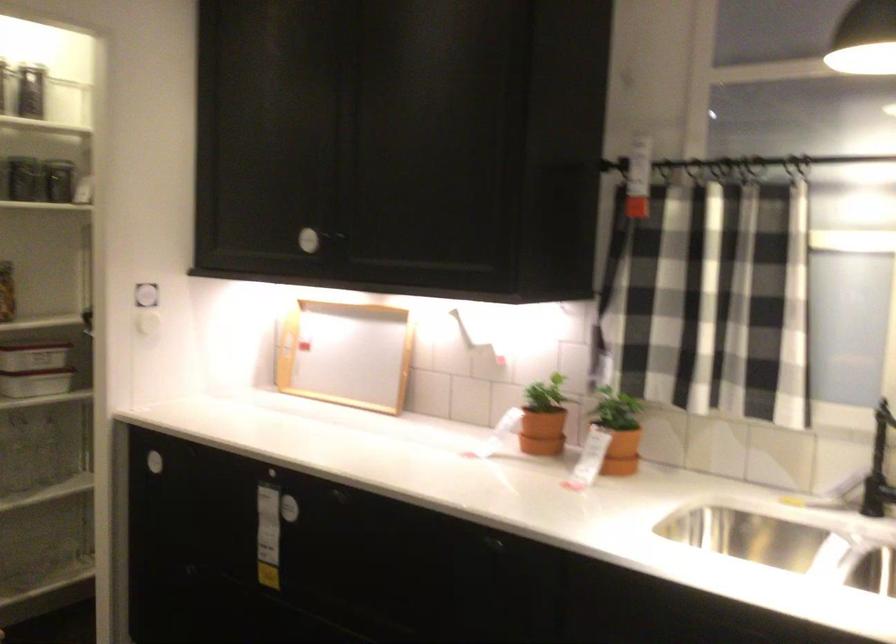
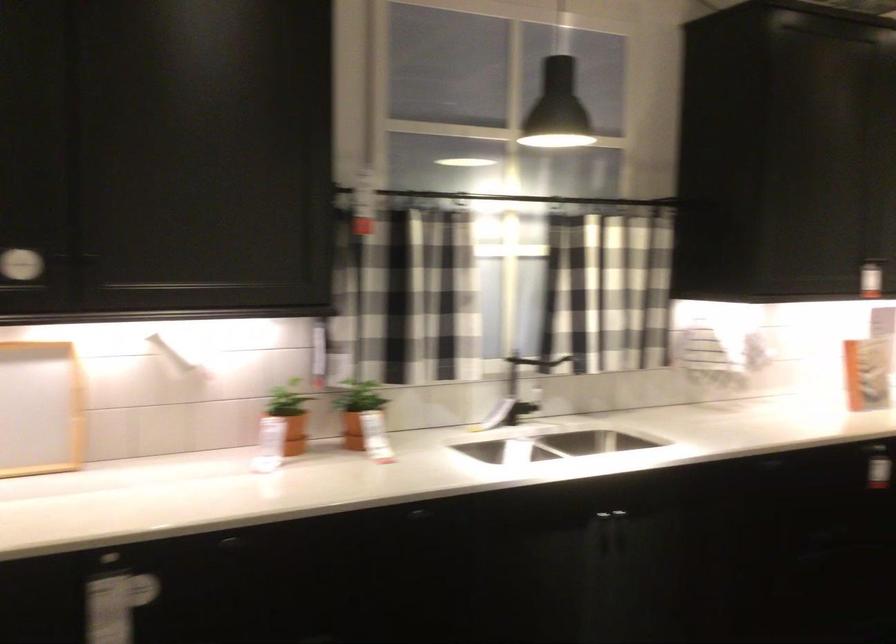
Find the pixel in the second image that matches pixel 555 410 in the first image.

(289, 415)